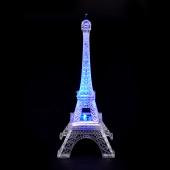
The image size is (170, 170). I want to click on arch, so click(x=85, y=142).